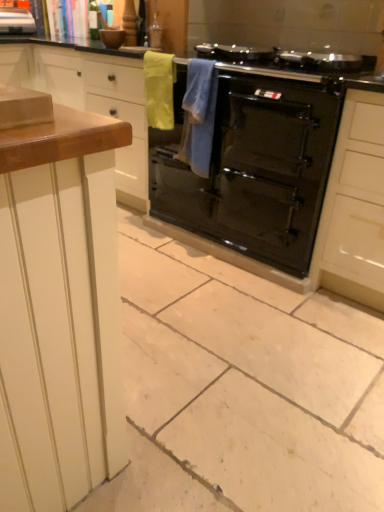
Question: Which direction should I rotate to look at blue towel at center, arranged as the 1th material when viewed from the right, — up or down?

Choices:
 (A) up
 (B) down

Answer: (A)

Question: Considering the relative positions of yellow fabric towel at upper center, the second material positioned from the right, and wooden countertop at left in the image provided, is yellow fabric towel at upper center, the second material positioned from the right, to the left of wooden countertop at left from the viewer's perspective?

Choices:
 (A) yes
 (B) no

Answer: (B)

Question: Is the depth of yellow fabric towel at upper center, the first material positioned from the left, greater than that of wooden countertop at left?

Choices:
 (A) no
 (B) yes

Answer: (A)

Question: Can you confirm if yellow fabric towel at upper center, the first material positioned from the left, is thinner than wooden countertop at left?

Choices:
 (A) no
 (B) yes

Answer: (B)

Question: From a real-world perspective, does yellow fabric towel at upper center, the first material positioned from the left, stand above wooden countertop at left?

Choices:
 (A) no
 (B) yes

Answer: (B)

Question: Is wooden countertop at left at the back of yellow fabric towel at upper center, the second material positioned from the right?

Choices:
 (A) no
 (B) yes

Answer: (A)

Question: From a real-world perspective, is yellow fabric towel at upper center, the second material positioned from the right, below wooden countertop at left?

Choices:
 (A) yes
 (B) no

Answer: (B)

Question: Is yellow fabric towel at upper center, the second material positioned from the right, at the back of metallic silver toaster at upper left?

Choices:
 (A) yes
 (B) no

Answer: (B)

Question: Is metallic silver toaster at upper left thinner than yellow fabric towel at upper center, the second material positioned from the right?

Choices:
 (A) no
 (B) yes

Answer: (A)

Question: Is metallic silver toaster at upper left to the right of yellow fabric towel at upper center, the second material positioned from the right, from the viewer's perspective?

Choices:
 (A) no
 (B) yes

Answer: (A)

Question: From a real-world perspective, does metallic silver toaster at upper left stand above yellow fabric towel at upper center, the first material positioned from the left?

Choices:
 (A) yes
 (B) no

Answer: (A)

Question: Does metallic silver toaster at upper left have a greater width compared to yellow fabric towel at upper center, the second material positioned from the right?

Choices:
 (A) no
 (B) yes

Answer: (B)

Question: Can you confirm if metallic silver toaster at upper left is bigger than yellow fabric towel at upper center, the second material positioned from the right?

Choices:
 (A) yes
 (B) no

Answer: (A)

Question: Is yellow fabric towel at upper center, the second material positioned from the right, positioned behind blue towel at center, arranged as the 1th material when viewed from the right?

Choices:
 (A) yes
 (B) no

Answer: (A)